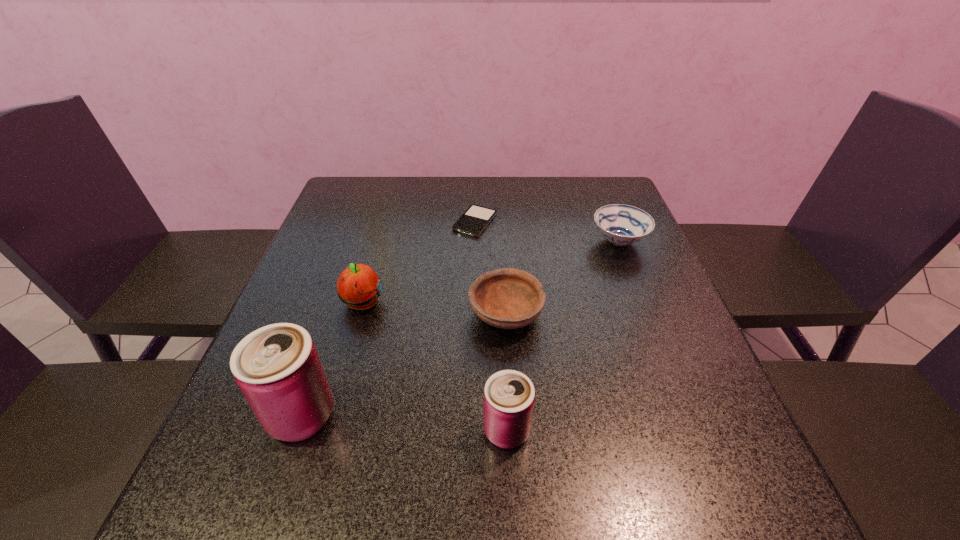
Locate an element on the screen. The width and height of the screenshot is (960, 540). free point that keeps the cans evenly spaced on the right is located at coordinates pyautogui.click(x=725, y=447).